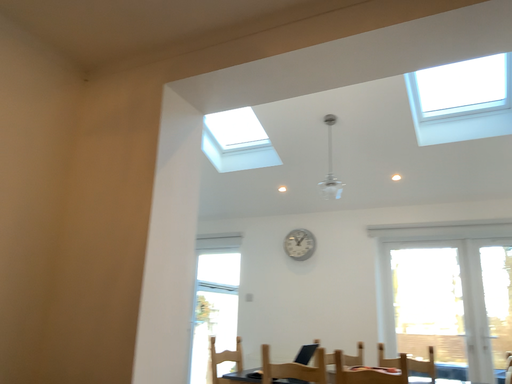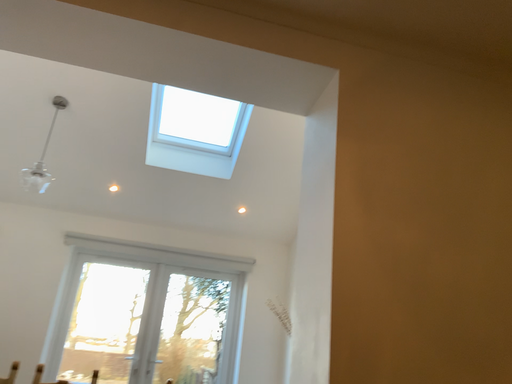
Question: How did the camera likely rotate when shooting the video?

Choices:
 (A) rotated right
 (B) rotated left

Answer: (A)